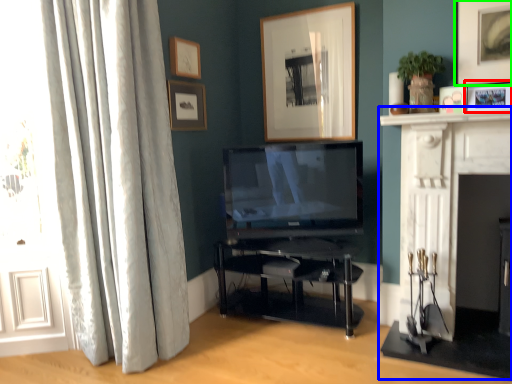
Question: Which is nearer to the picture frame (highlighted by a red box)? fireplace (highlighted by a blue box) or picture frame (highlighted by a green box).

Choices:
 (A) fireplace
 (B) picture frame

Answer: (B)